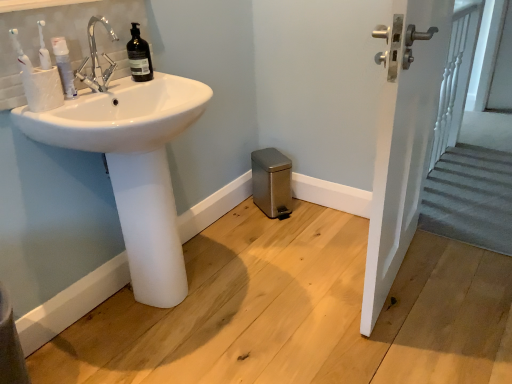
In order to click on vacant area to the left of white glossy door handle at upper right in this screenshot , I will do `click(293, 277)`.